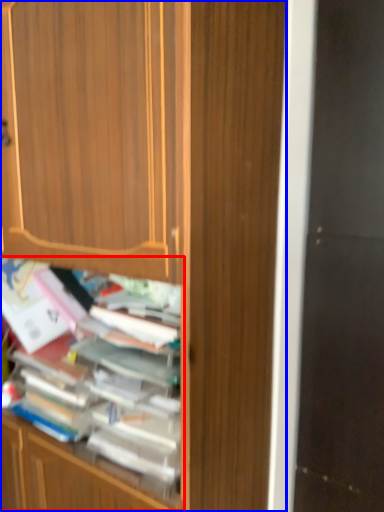
Question: Which object appears farthest to the camera in this image, shelf (highlighted by a red box) or cabinetry (highlighted by a blue box)?

Choices:
 (A) shelf
 (B) cabinetry

Answer: (A)